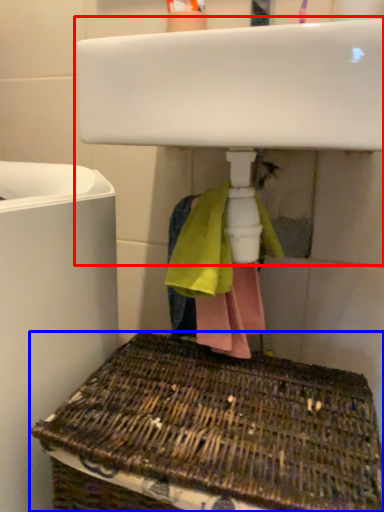
Question: Which object appears closest to the camera in this image, sink (highlighted by a red box) or basket (highlighted by a blue box)?

Choices:
 (A) sink
 (B) basket

Answer: (B)